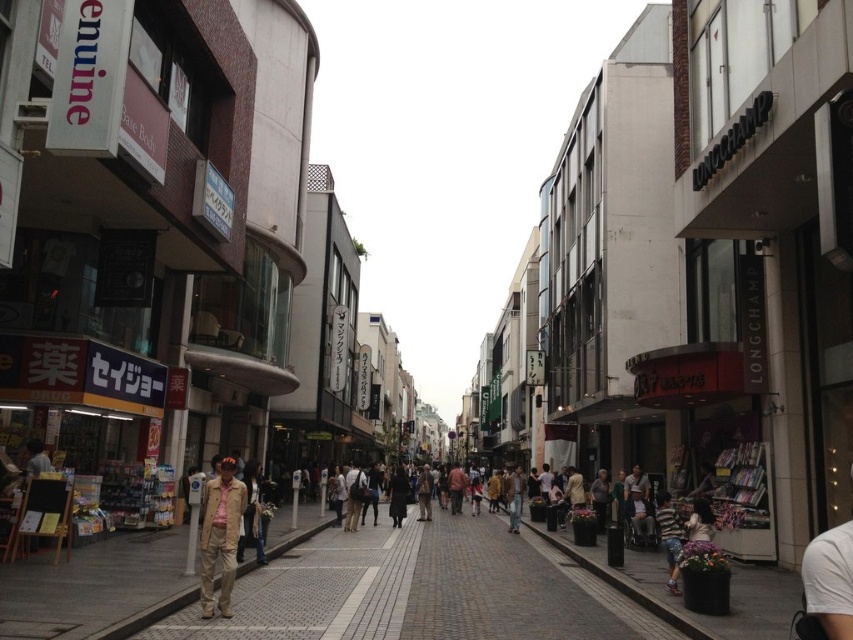
Question: Among these objects, which one is nearest to the camera?

Choices:
 (A) tan fabric jacket at lower left
 (B) brick pavement at center

Answer: (B)

Question: Can you confirm if brick pavement at center is smaller than tan fabric jacket at lower left?

Choices:
 (A) no
 (B) yes

Answer: (A)

Question: Where is brick pavement at center located in relation to tan fabric jacket at lower left in the image?

Choices:
 (A) below
 (B) above

Answer: (A)

Question: Which point is closer to the camera?

Choices:
 (A) (212, 477)
 (B) (384, 573)

Answer: (B)

Question: Which point appears closest to the camera in this image?

Choices:
 (A) (233, 538)
 (B) (375, 637)

Answer: (B)

Question: Is brick pavement at center to the left of tan fabric jacket at lower left from the viewer's perspective?

Choices:
 (A) no
 (B) yes

Answer: (A)